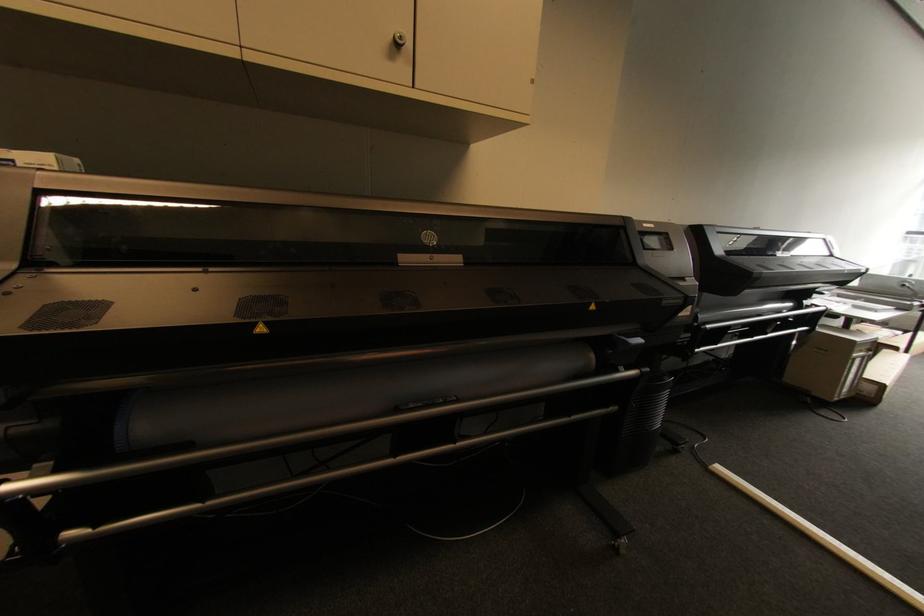
Describe the element at coordinates (766, 260) in the screenshot. This screenshot has width=924, height=616. I see `the large printer lid` at that location.